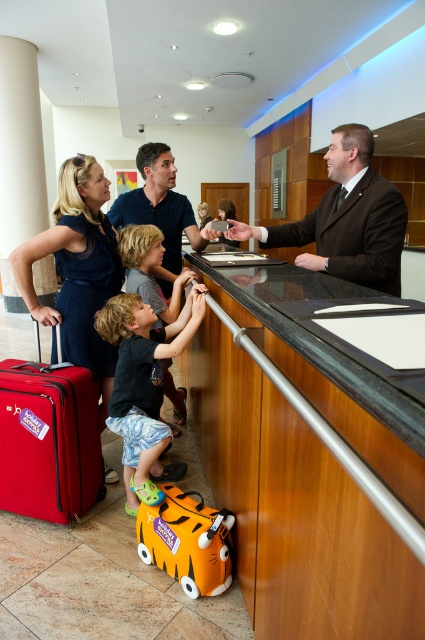
Question: Which of the following is the closest to the observer?

Choices:
 (A) orange plastic suitcase at lower center
 (B) dark brown suit at center
 (C) red matte suitcase at lower left
 (D) black matte shirt at center

Answer: (A)

Question: Which of the following is the closest to the observer?

Choices:
 (A) (187, 502)
 (B) (138, 371)

Answer: (A)

Question: Which point appears farthest from the camera in this image?

Choices:
 (A) (79, 292)
 (B) (150, 204)
 (C) (175, 538)
 (D) (132, 480)

Answer: (B)

Question: Is polished granite counter at center positioned at the back of matte blue shirt at center?

Choices:
 (A) yes
 (B) no

Answer: (B)

Question: Does matte black dress at center have a smaller size compared to dark brown suit at center?

Choices:
 (A) no
 (B) yes

Answer: (A)

Question: Observing the image, what is the correct spatial positioning of black matte shirt at center in reference to orange fabric suitcase at center?

Choices:
 (A) right
 (B) left

Answer: (B)